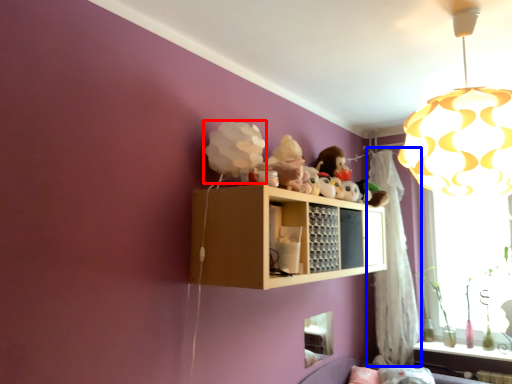
Question: Which object appears farthest to the camera in this image, toy (highlighted by a red box) or curtain (highlighted by a blue box)?

Choices:
 (A) toy
 (B) curtain

Answer: (B)